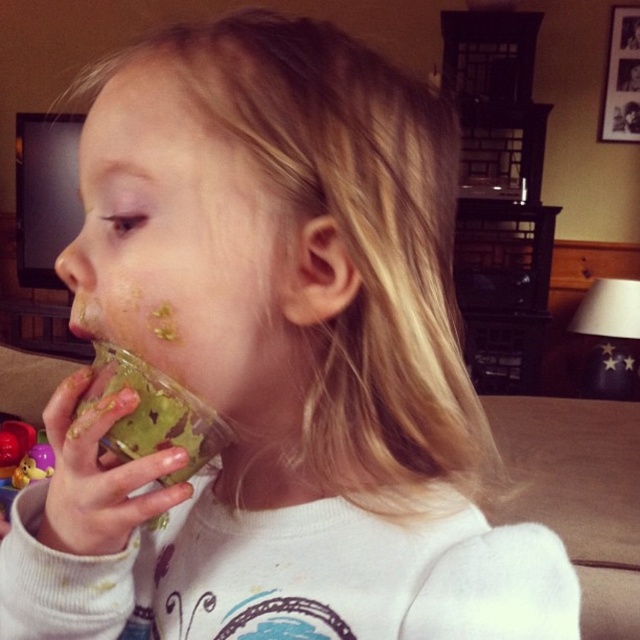
Question: Which of the following is the farthest from the observer?

Choices:
 (A) rubber duck at lower left
 (B) green leafy drink at mouth

Answer: (A)

Question: Does green leafy drink at mouth lie behind rubber duck at lower left?

Choices:
 (A) yes
 (B) no

Answer: (B)

Question: In this image, where is green leafy drink at mouth located relative to rubber duck at lower left?

Choices:
 (A) right
 (B) left

Answer: (A)

Question: Which object is farther from the camera taking this photo?

Choices:
 (A) green leafy drink at mouth
 (B) rubber duck at lower left

Answer: (B)

Question: Is green leafy drink at mouth closer to camera compared to rubber duck at lower left?

Choices:
 (A) yes
 (B) no

Answer: (A)